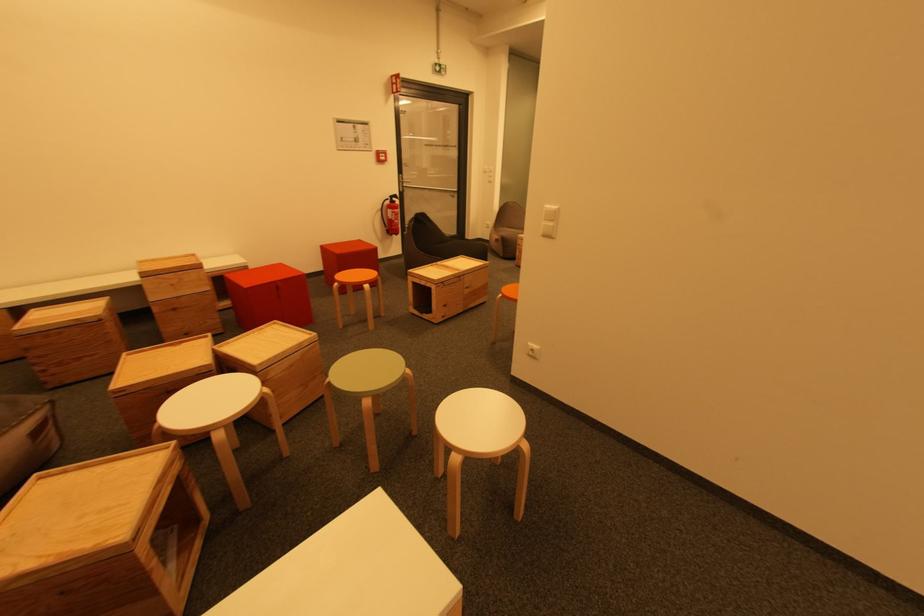
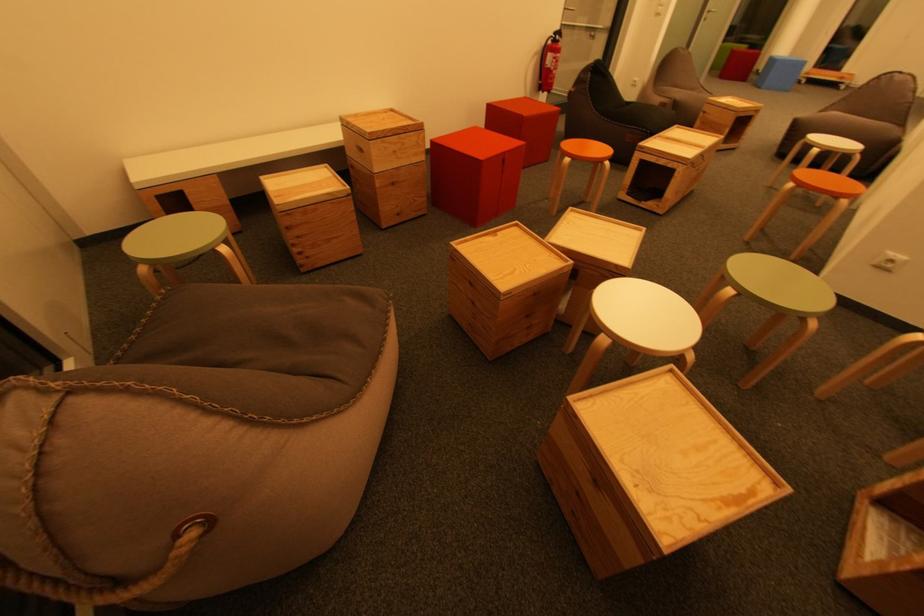
Question: The images are taken continuously from a first-person perspective. In which direction are you moving?

Choices:
 (A) Left
 (B) Right
 (C) Forward
 (D) Backward

Answer: (A)